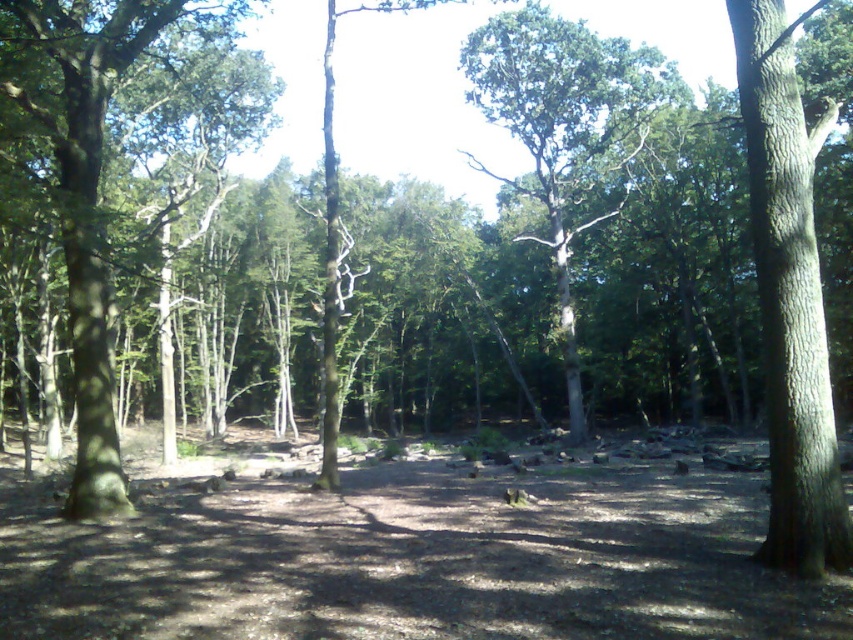
Question: Considering the relative positions of smooth bark tree at right and green matte tree at left in the image provided, where is smooth bark tree at right located with respect to green matte tree at left?

Choices:
 (A) left
 (B) right

Answer: (B)

Question: Can you confirm if green leafy tree at center is smaller than green matte tree at left?

Choices:
 (A) no
 (B) yes

Answer: (A)

Question: Which point is farther to the camera?

Choices:
 (A) smooth bark tree at right
 (B) green matte tree at left

Answer: (B)

Question: Does smooth bark tree at right appear under green matte tree at left?

Choices:
 (A) yes
 (B) no

Answer: (A)

Question: Which point appears closest to the camera in this image?

Choices:
 (A) pyautogui.click(x=821, y=465)
 (B) pyautogui.click(x=544, y=10)
 (C) pyautogui.click(x=115, y=74)

Answer: (A)

Question: Which object appears farthest from the camera in this image?

Choices:
 (A) green matte tree at left
 (B) smooth bark tree at right

Answer: (A)